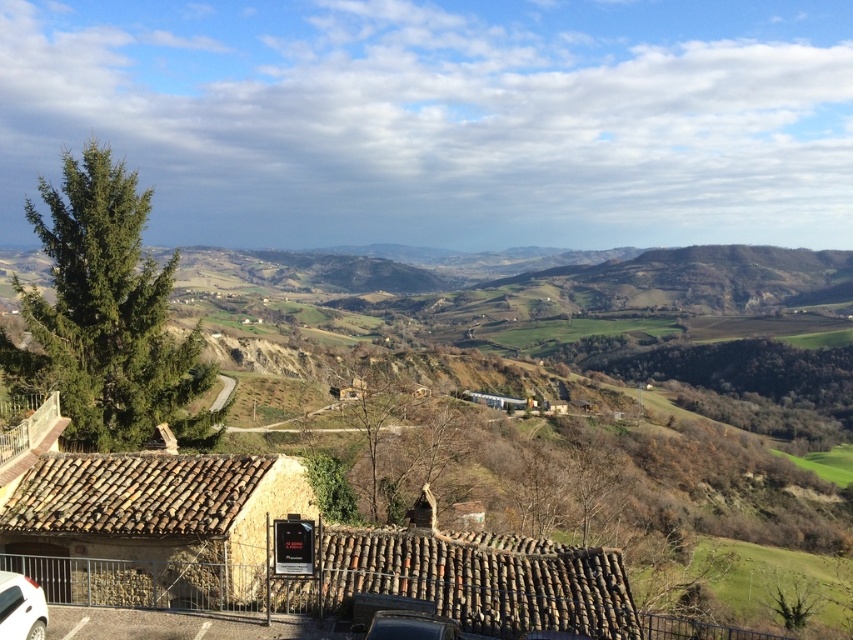
Is white glossy car at lower left above shiny black car at lower center?

Yes.

Where is `white glossy car at lower left`? This screenshot has height=640, width=853. white glossy car at lower left is located at coordinates (21, 608).

At what (x,y) coordinates should I click in order to perform the action: click on white glossy car at lower left. Please return your answer as a coordinate pair (x, y). Looking at the image, I should click on (21, 608).